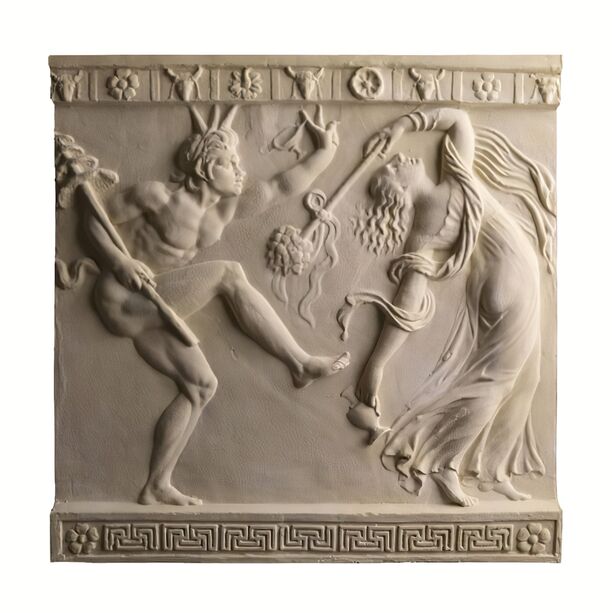
Locate an element on the screen. teacup is located at coordinates (278, 141).